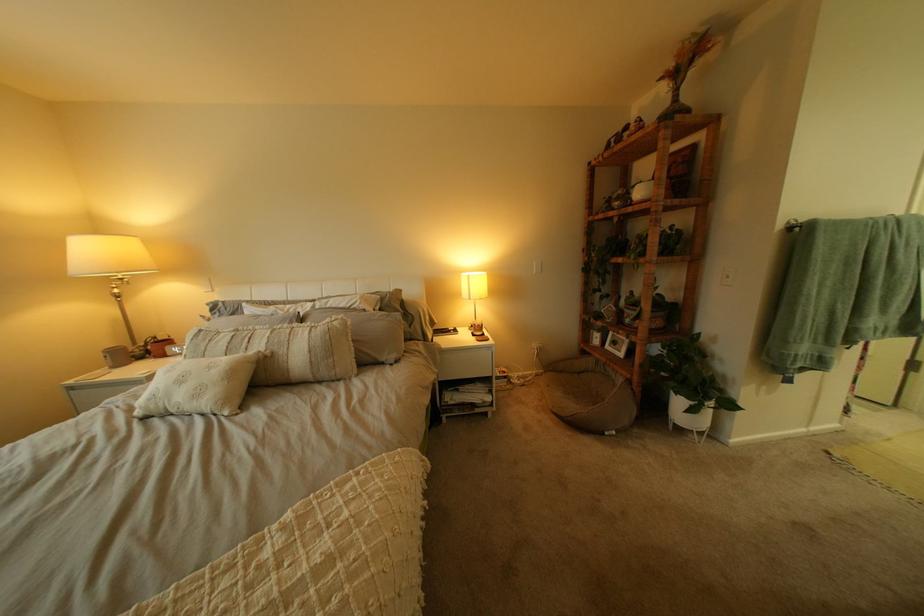
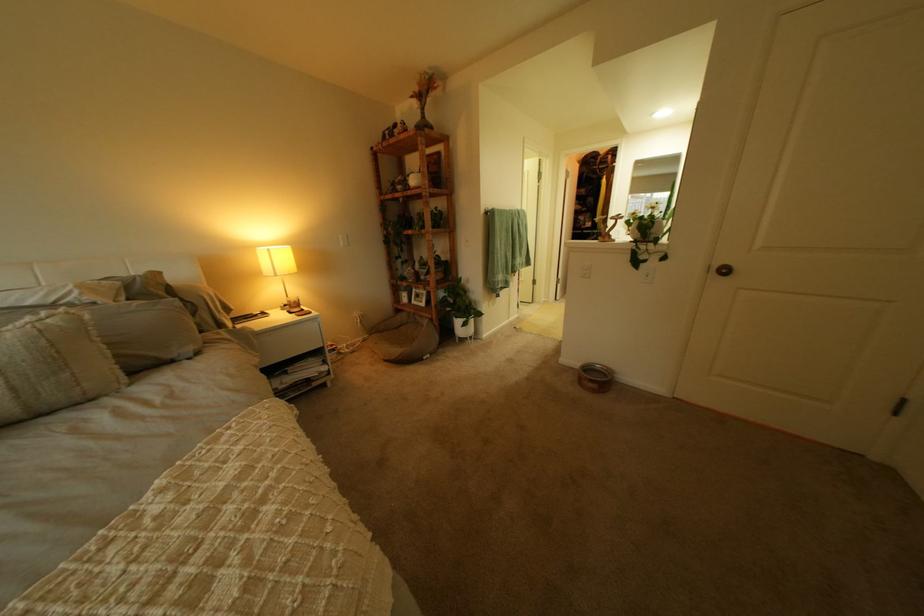
Question: The camera is either moving clockwise (left) or counter-clockwise (right) around the object. The first image is from the beginning of the video and the second image is from the end. Is the camera moving left or right when shooting the video?

Choices:
 (A) Left
 (B) Right

Answer: (A)